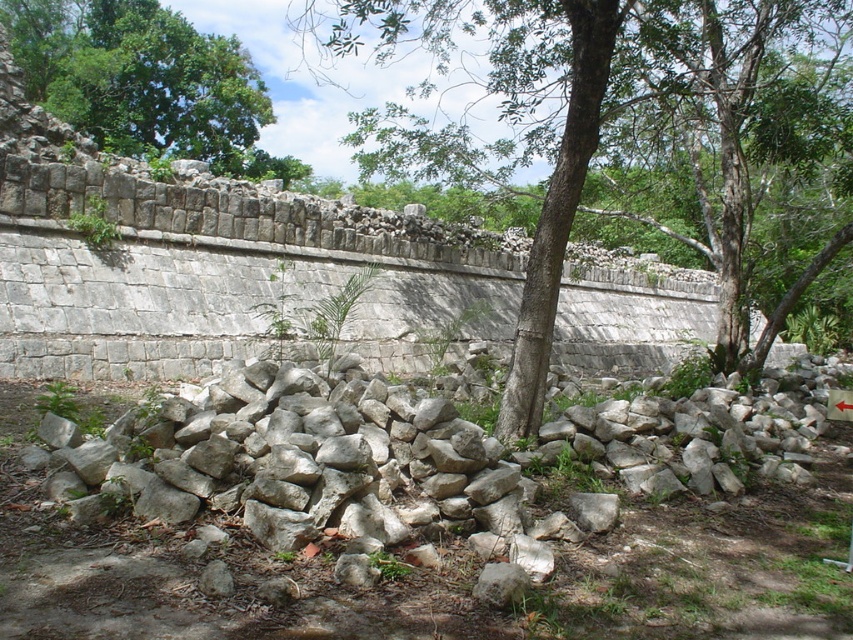
Question: Among these objects, which one is farthest from the camera?

Choices:
 (A) white rough stones at center
 (B) green leafy tree at upper left

Answer: (B)

Question: Is white rough stones at center smaller than green rough bark tree at center?

Choices:
 (A) yes
 (B) no

Answer: (A)

Question: Which of the following is the closest to the observer?

Choices:
 (A) green rough bark tree at center
 (B) white rough stones at center
 (C) green leafy tree at upper left

Answer: (B)

Question: Is white rough stones at center wider than green leafy tree at upper left?

Choices:
 (A) yes
 (B) no

Answer: (B)

Question: Can you confirm if white rough stones at center is bigger than green leafy tree at upper left?

Choices:
 (A) no
 (B) yes

Answer: (A)

Question: Among these objects, which one is farthest from the camera?

Choices:
 (A) white rough stones at center
 (B) green rough bark tree at center
 (C) green leafy tree at upper left

Answer: (C)